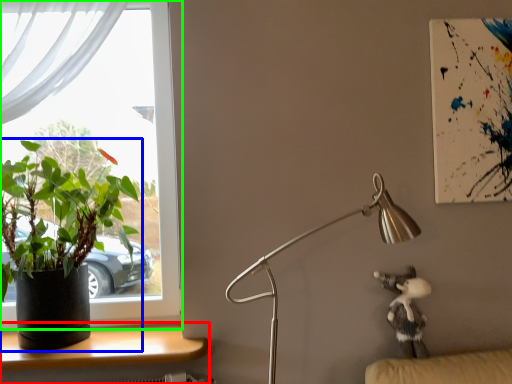
Question: Which object is positioned farthest from desk (highlighted by a red box)? Select from houseplant (highlighted by a blue box) and window (highlighted by a green box).

Choices:
 (A) houseplant
 (B) window

Answer: (B)